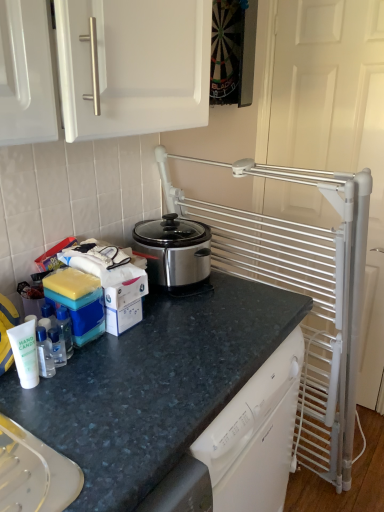
You are a GUI agent. You are given a task and a screenshot of the screen. Output one action in this format:
    pyautogui.click(x=<x>, y=<y>)
    Task: Click on the free spot in front of clear plastic bottle at lower left, marked as the second bottle in a front-to-back arrangement
    Image resolution: width=384 pixels, height=512 pixels.
    Given the screenshot: What is the action you would take?
    click(x=43, y=419)